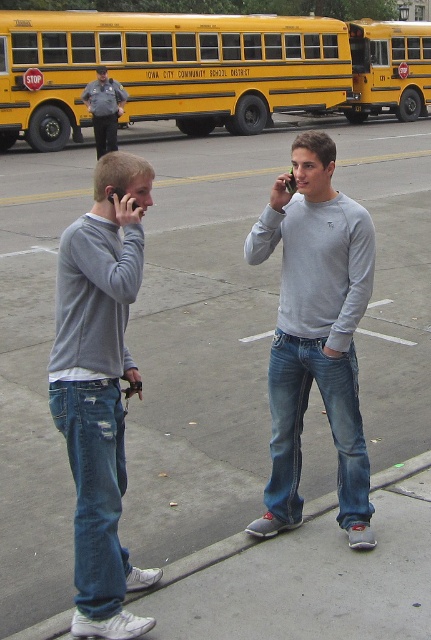
Does point (177, 32) come behind point (84, 390)?

Yes, it is.

Which of these two, yellow painted school bus at upper center or ripped denim jeans at left, stands taller?

Standing taller between the two is yellow painted school bus at upper center.

What are the coordinates of `yellow painted school bus at upper center` in the screenshot? It's located at (165, 68).

Does ripped denim jeans at left have a lesser width compared to concrete at lower center?

Incorrect, ripped denim jeans at left's width is not less than concrete at lower center's.

The image size is (431, 640). What do you see at coordinates (99, 387) in the screenshot?
I see `ripped denim jeans at left` at bounding box center [99, 387].

Where is `ripped denim jeans at left`? ripped denim jeans at left is located at coordinates (99, 387).

Between point (124, 182) and point (397, 38), which one is positioned in front?

Point (124, 182) is in front.

Does ripped denim jeans at left have a lesser width compared to yellow painted metal school bus at center?

Yes, ripped denim jeans at left is thinner than yellow painted metal school bus at center.

Describe the element at coordinates (99, 387) in the screenshot. I see `ripped denim jeans at left` at that location.

Image resolution: width=431 pixels, height=640 pixels. Find the location of `ripped denim jeans at left`. ripped denim jeans at left is located at coordinates (99, 387).